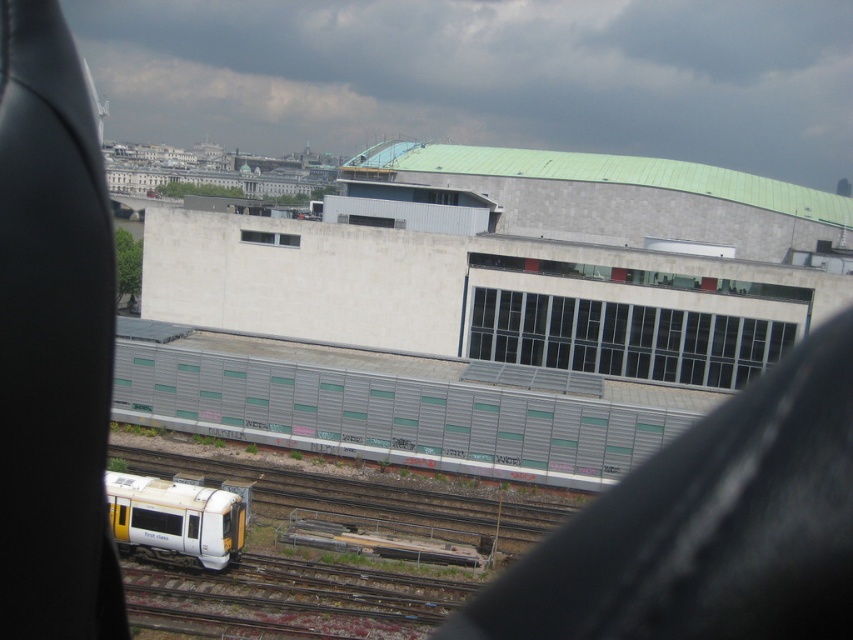
You are standing at the camera position and want to know how far the metallic gray train at center is from you. Can you determine the distance?

The metallic gray train at center and camera are 59.52 meters apart, so the distance between you and the metallic gray train at center is 59.52 meters.

You are standing at the vantage point and want to take a photo of the metallic gray train at center without including the transparent glass window at center in the frame. Which direction should you move to achieve this?

The metallic gray train at center is positioned on the right side of the transparent glass window at center. To exclude the window from the photo, you should move to the left side of the window so that the train remains in view while the window is out of frame.

Consider the image. You are an architect designing a new building and want to ensure that the transparent glass windows at center will not block the view of the white glossy passenger train at lower left from the building. Based on the scene, can you confirm if the windows are large enough to allow the train to be seen clearly?

The transparent glass windows at center are larger in size than the white glossy passenger train at lower left, so they should provide a clear view of the train as long as there are no obstructions between them.